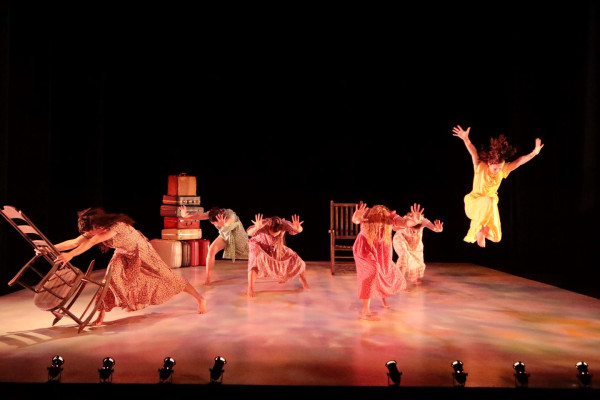
Identify the location of stage. The height and width of the screenshot is (400, 600). (320, 340).